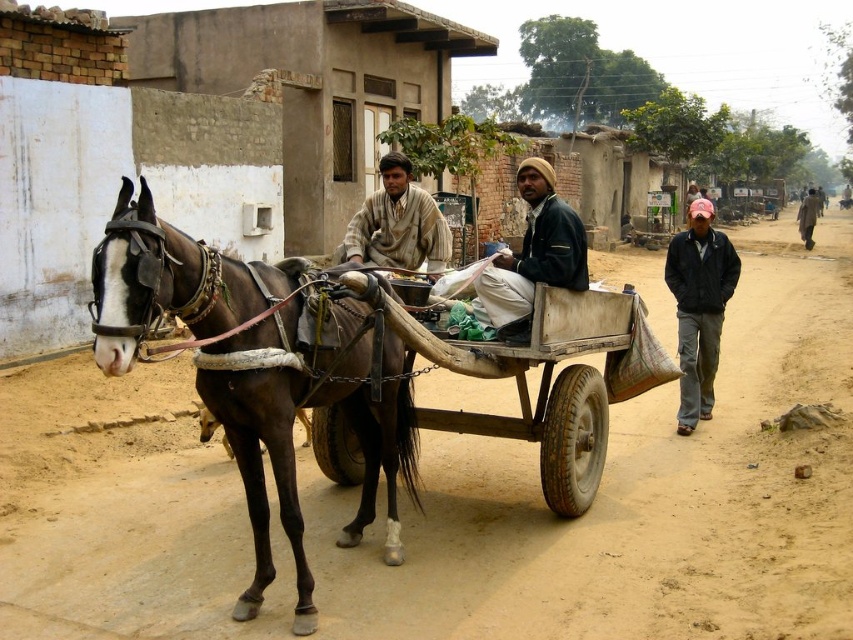
Is wooden cart at center taller than dark brown leather jacket at center?

Correct, wooden cart at center is much taller as dark brown leather jacket at center.

You are a GUI agent. You are given a task and a screenshot of the screen. Output one action in this format:
    pyautogui.click(x=<x>, y=<y>)
    Task: Click on the wooden cart at center
    The width and height of the screenshot is (853, 640).
    Given the screenshot: What is the action you would take?
    coord(543,387)

Where is `wooden cart at center`? This screenshot has width=853, height=640. wooden cart at center is located at coordinates (543, 387).

Between brown dirt track at lower left and pink fabric cap at right, which one is positioned lower?

brown dirt track at lower left is lower down.

Which is in front, point (320, 509) or point (688, 330)?

Point (320, 509) is in front.

Does point (456, 596) come closer to viewer compared to point (701, 337)?

Yes, it is in front of point (701, 337).

You are a GUI agent. You are given a task and a screenshot of the screen. Output one action in this format:
    pyautogui.click(x=<x>, y=<y>)
    Task: Click on the brown dirt track at lower left
    
    Given the screenshot: What is the action you would take?
    pyautogui.click(x=640, y=499)

From the picture: Which is more to the left, brown glossy horse at left or dark brown leather jacket at center?

brown glossy horse at left is more to the left.

Describe the element at coordinates (260, 371) in the screenshot. The image size is (853, 640). I see `brown glossy horse at left` at that location.

Who is more distant from viewer, (200,360) or (570,282)?

Positioned behind is point (570,282).

Locate an element on the screen. The height and width of the screenshot is (640, 853). brown glossy horse at left is located at coordinates (260, 371).